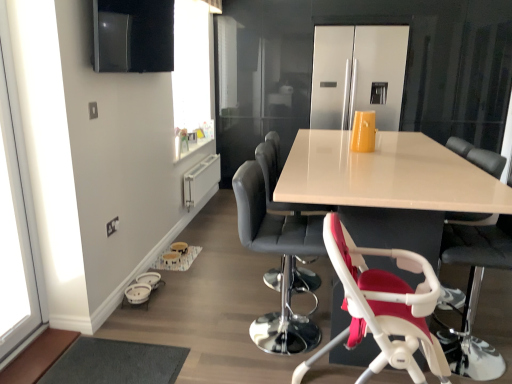
This screenshot has width=512, height=384. I want to click on free location to the right of transparent glass window at left, so click(65, 353).